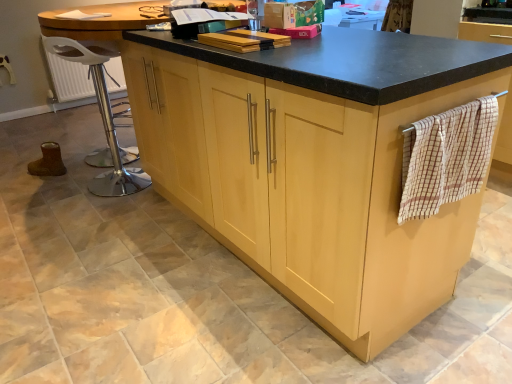
This screenshot has height=384, width=512. Identify the location of free space on the front side of metallic silver bar stool at left. (x=100, y=210).